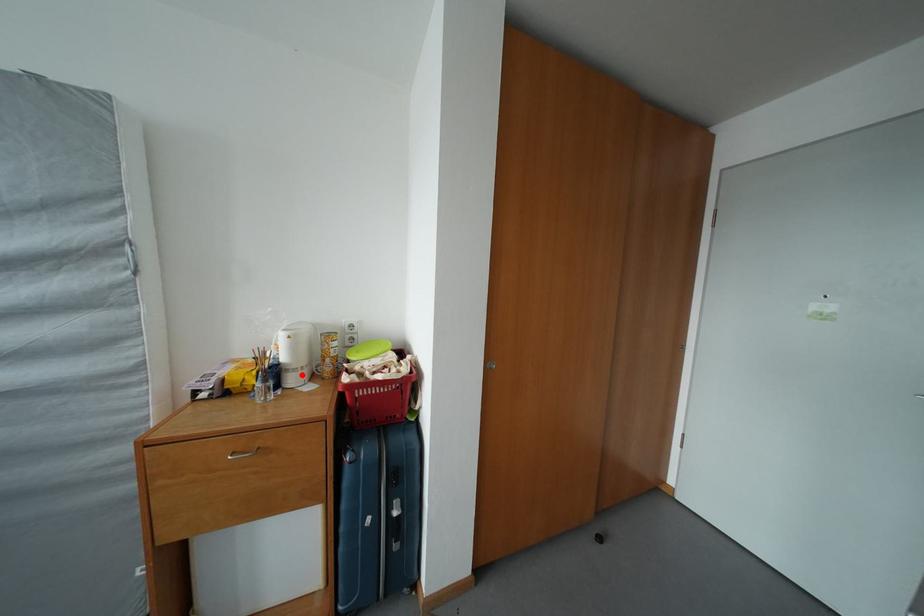
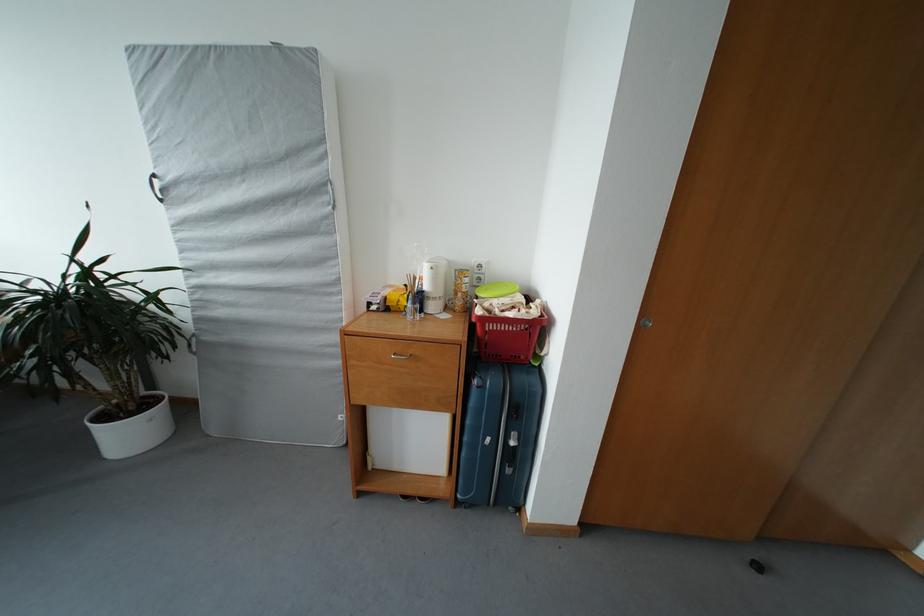
In the second image, find the point that corresponds to the highlighted location in the first image.

(441, 304)